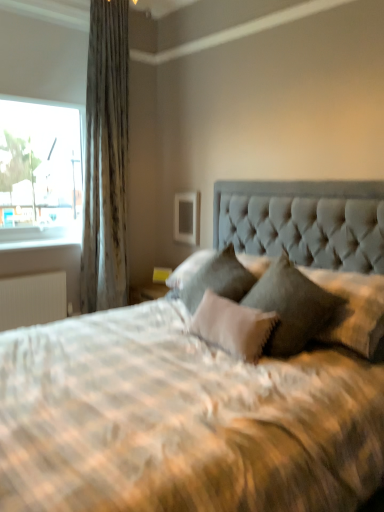
What do you see at coordinates (106, 159) in the screenshot? I see `satin fabric curtain at left` at bounding box center [106, 159].

Where is `white textured pillow at center, which appears as the second pillow when viewed from the right`? This screenshot has width=384, height=512. white textured pillow at center, which appears as the second pillow when viewed from the right is located at coordinates (232, 326).

Image resolution: width=384 pixels, height=512 pixels. Describe the element at coordinates (41, 242) in the screenshot. I see `white plastic window sill at left` at that location.

Measure the distance between white plastic window sill at left and camera.

white plastic window sill at left and camera are 3.18 meters apart from each other.

Where is `satin fabric curtain at left`? satin fabric curtain at left is located at coordinates (106, 159).

Is white plastic window sill at left smaller than satin fabric curtain at left?

Yes, white plastic window sill at left is smaller than satin fabric curtain at left.

Is white plastic window sill at left far away from satin fabric curtain at left?

No.

Does point (47, 239) come in front of point (116, 134)?

No.

How different are the orientations of white plastic window sill at left and satin fabric curtain at left in degrees?

0.0171 degrees.

In the image, is white matte radiator at lower left positioned in front of or behind satin fabric curtain at left?

In the image, white matte radiator at lower left appears behind satin fabric curtain at left.

From the image's perspective, would you say white matte radiator at lower left is shown under satin fabric curtain at left?

Indeed, from the image's perspective, white matte radiator at lower left is shown beneath satin fabric curtain at left.

Can satin fabric curtain at left be found inside white matte radiator at lower left?

No, satin fabric curtain at left is not inside white matte radiator at lower left.

In the image, there is a satin fabric curtain at left. Identify the location of radiator below it (from the image's perspective). (32, 298).

Based on their positions, is velvet gray pillow at center, which ranks as the third pillow in left-to-right order, located to the left or right of white matte radiator at lower left?

In the image, velvet gray pillow at center, which ranks as the third pillow in left-to-right order, appears on the right side of white matte radiator at lower left.

Considering the relative positions of velvet gray pillow at center, placed as the 1th pillow when sorted from right to left, and white matte radiator at lower left in the image provided, is velvet gray pillow at center, placed as the 1th pillow when sorted from right to left, behind white matte radiator at lower left?

No, velvet gray pillow at center, placed as the 1th pillow when sorted from right to left, is in front of white matte radiator at lower left.

Image resolution: width=384 pixels, height=512 pixels. What are the coordinates of `radiator below the velvet gray pillow at center, placed as the 1th pillow when sorted from right to left (from a real-world perspective)` in the screenshot? It's located at (32, 298).

Would you say velvet gray pillow at center, which ranks as the third pillow in left-to-right order, is outside white matte radiator at lower left?

Yes, velvet gray pillow at center, which ranks as the third pillow in left-to-right order, is not within white matte radiator at lower left.

Is velvet gray pillow at center, the 1th pillow from the left, inside the boundaries of white textured pillow at center, which appears as the second pillow when viewed from the right, or outside?

velvet gray pillow at center, the 1th pillow from the left, is spatially situated outside white textured pillow at center, which appears as the second pillow when viewed from the right.

From a real-world perspective, which object rests below the other?

white textured pillow at center, which appears as the second pillow when viewed from the right.

Does point (248, 272) come closer to viewer compared to point (209, 334)?

No.

Is point (217, 298) less distant than point (15, 313)?

Yes, it is.

Considering the relative sizes of white textured pillow at center, which appears as the second pillow when viewed from the right, and white matte radiator at lower left in the image provided, is white textured pillow at center, which appears as the second pillow when viewed from the right, taller than white matte radiator at lower left?

No, white textured pillow at center, which appears as the second pillow when viewed from the right, is not taller than white matte radiator at lower left.

From the image's perspective, who appears lower, white textured pillow at center, which appears as the second pillow when viewed from the right, or white matte radiator at lower left?

white matte radiator at lower left, from the image's perspective.

Between white matte radiator at lower left and velvet gray pillow at center, the 3th pillow in the right-to-left sequence, which one has larger width?

velvet gray pillow at center, the 3th pillow in the right-to-left sequence.

Consider the image. Is white matte radiator at lower left inside or outside of velvet gray pillow at center, the 1th pillow from the left?

white matte radiator at lower left cannot be found inside velvet gray pillow at center, the 1th pillow from the left.

From a real-world perspective, between white plastic window sill at left and velvet gray pillow at center, the 1th pillow from the left, who is vertically lower?

From a 3D spatial view, velvet gray pillow at center, the 1th pillow from the left, is below.

Is velvet gray pillow at center, the 1th pillow from the left, at the back of white plastic window sill at left?

No, white plastic window sill at left is not facing the opposite direction of velvet gray pillow at center, the 1th pillow from the left.

Is velvet gray pillow at center, the 1th pillow from the left, inside white plastic window sill at left?

No, velvet gray pillow at center, the 1th pillow from the left, is not a part of white plastic window sill at left.

Consider the image. Is white plastic window sill at left wider or thinner than velvet gray pillow at center, the 3th pillow in the right-to-left sequence?

white plastic window sill at left is thinner than velvet gray pillow at center, the 3th pillow in the right-to-left sequence.

Where is `window sill that appears behind the satin fabric curtain at left`? window sill that appears behind the satin fabric curtain at left is located at coordinates (41, 242).

Locate an element on the screen. The height and width of the screenshot is (512, 384). curtain in front of the white matte radiator at lower left is located at coordinates (106, 159).

From the image, which object appears to be nearer to velvet gray pillow at center, which ranks as the third pillow in left-to-right order, white matte radiator at lower left or white plastic window sill at left?

white matte radiator at lower left is closer to velvet gray pillow at center, which ranks as the third pillow in left-to-right order.

Which object lies further to the anchor point white plastic window sill at left, white textured pillow at center, which appears as the second pillow when viewed from the right, or velvet gray pillow at center, placed as the 1th pillow when sorted from right to left?

Among the two, velvet gray pillow at center, placed as the 1th pillow when sorted from right to left, is located further to white plastic window sill at left.

Looking at the image, which one is located further to white matte radiator at lower left, satin fabric curtain at left or white plastic window sill at left?

satin fabric curtain at left lies further to white matte radiator at lower left than the other object.

Which object lies further to the anchor point velvet gray pillow at center, which ranks as the third pillow in left-to-right order, white textured pillow at center, which appears as the second pillow when viewed from the right, or satin fabric curtain at left?

satin fabric curtain at left.

Which object lies further to the anchor point velvet gray pillow at center, the 3th pillow in the right-to-left sequence, velvet gray pillow at center, placed as the 1th pillow when sorted from right to left, or white textured pillow at center, which appears as the second pillow when viewed from the right?

velvet gray pillow at center, placed as the 1th pillow when sorted from right to left.

Based on the photo, when comparing their distances from white matte radiator at lower left, does white textured pillow at center, the second pillow positioned from the left, or velvet gray pillow at center, which ranks as the third pillow in left-to-right order, seem closer?

white textured pillow at center, the second pillow positioned from the left, is closer to white matte radiator at lower left.

Which object lies nearer to the anchor point velvet gray pillow at center, placed as the 1th pillow when sorted from right to left, velvet gray pillow at center, the 1th pillow from the left, or satin fabric curtain at left?

velvet gray pillow at center, the 1th pillow from the left, is positioned closer to the anchor velvet gray pillow at center, placed as the 1th pillow when sorted from right to left.

Based on their spatial positions, is velvet gray pillow at center, which ranks as the third pillow in left-to-right order, or satin fabric curtain at left closer to white textured pillow at center, the second pillow positioned from the left?

velvet gray pillow at center, which ranks as the third pillow in left-to-right order, lies closer to white textured pillow at center, the second pillow positioned from the left, than the other object.

In order to click on curtain between white textured pillow at center, the second pillow positioned from the left, and white plastic window sill at left, along the z-axis in this screenshot , I will do `click(106, 159)`.

The width and height of the screenshot is (384, 512). Identify the location of curtain between white plastic window sill at left and velvet gray pillow at center, the 1th pillow from the left, from left to right. (106, 159).

Where is `curtain located between white matte radiator at lower left and velvet gray pillow at center, placed as the 1th pillow when sorted from right to left, in the left-right direction`? This screenshot has height=512, width=384. curtain located between white matte radiator at lower left and velvet gray pillow at center, placed as the 1th pillow when sorted from right to left, in the left-right direction is located at coordinates (106, 159).

Image resolution: width=384 pixels, height=512 pixels. Identify the location of curtain between white matte radiator at lower left and velvet gray pillow at center, the 3th pillow in the right-to-left sequence, from left to right. (106, 159).